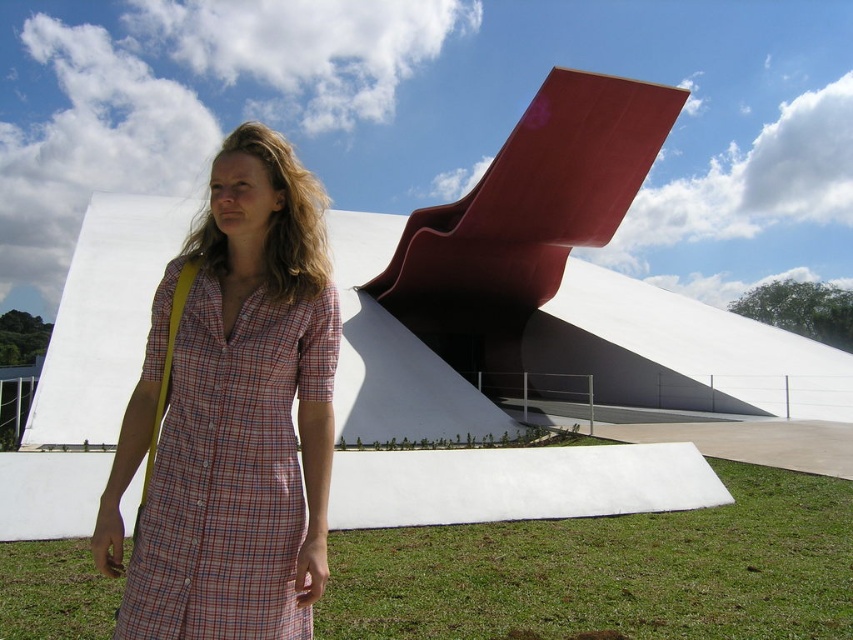
You are a drone operator trying to land a drone on the green grass at lower center. According to the coordinates provided, what are the exact coordinates where you should aim the drone?

The exact coordinates for the green grass at lower center are at point (610,572).

Consider the image. You are a photographer planning to capture a wide shot of the scene. Given that the green grass at lower center and the plaid cotton dress at center are both in the frame, which object occupies more horizontal space in the image?

The green grass at lower center occupies more horizontal space in the image because its width is larger than that of the plaid cotton dress at center.